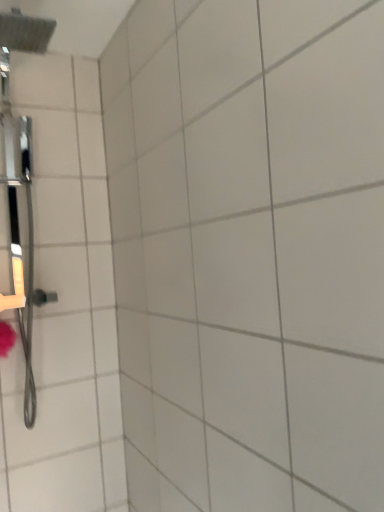
The height and width of the screenshot is (512, 384). What do you see at coordinates (249, 252) in the screenshot?
I see `white ceramic tile at center` at bounding box center [249, 252].

Measure the distance between white ceramic tile at center and camera.

white ceramic tile at center and camera are 25.29 inches apart.

The image size is (384, 512). I want to click on white ceramic tile at center, so click(249, 252).

Locate an element on the screen. Image resolution: width=384 pixels, height=512 pixels. white ceramic tile at center is located at coordinates pos(249,252).